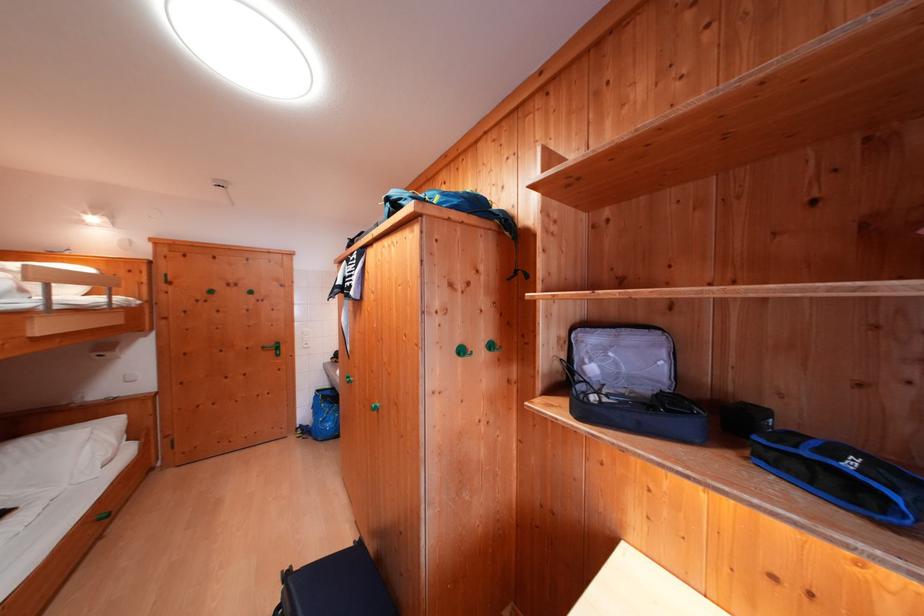
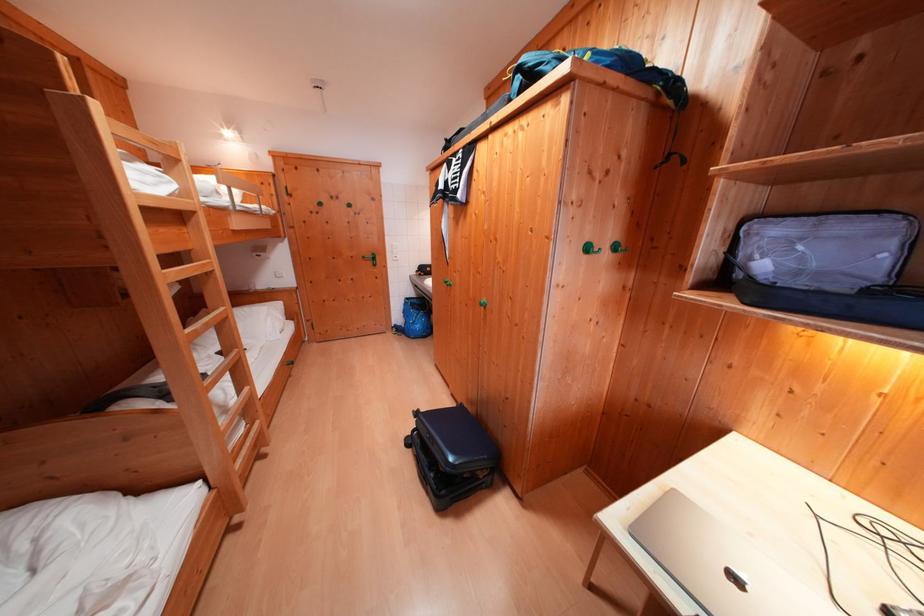
Question: Based on the continuous images, in which direction is the camera rotating? Reply with the corresponding letter.

Choices:
 (A) Left
 (B) Right
 (C) Up
 (D) Down

Answer: (D)